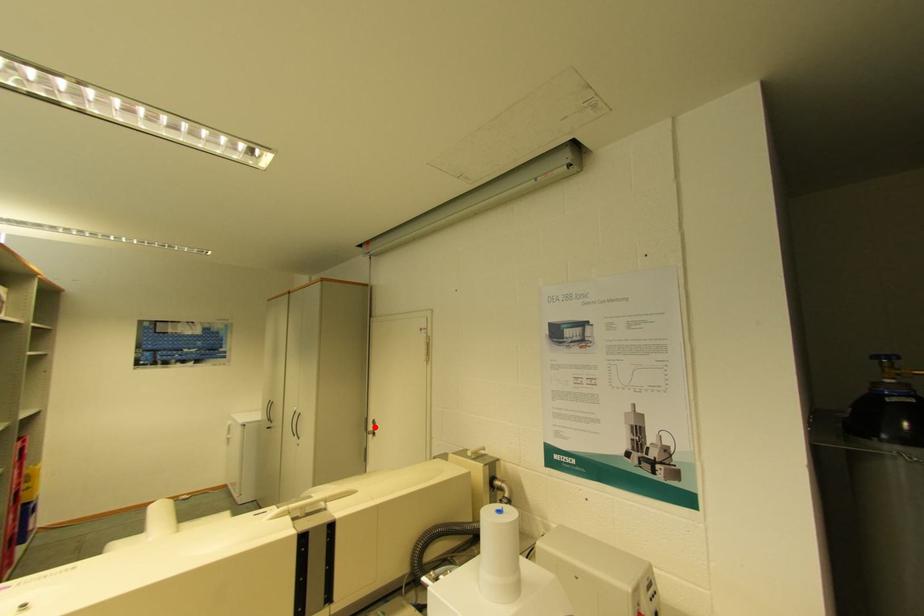
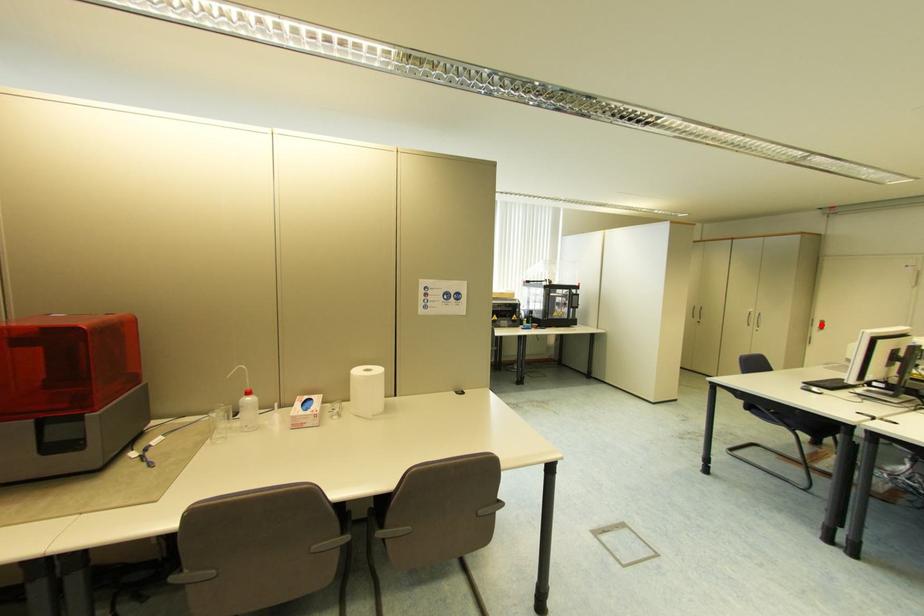
I am providing you with two images of the same scene from different viewpoints. A red point is marked on the first image and another point is marked on the second image. Do the highlighted points in image1 and image2 indicate the same real-world spot?

Yes